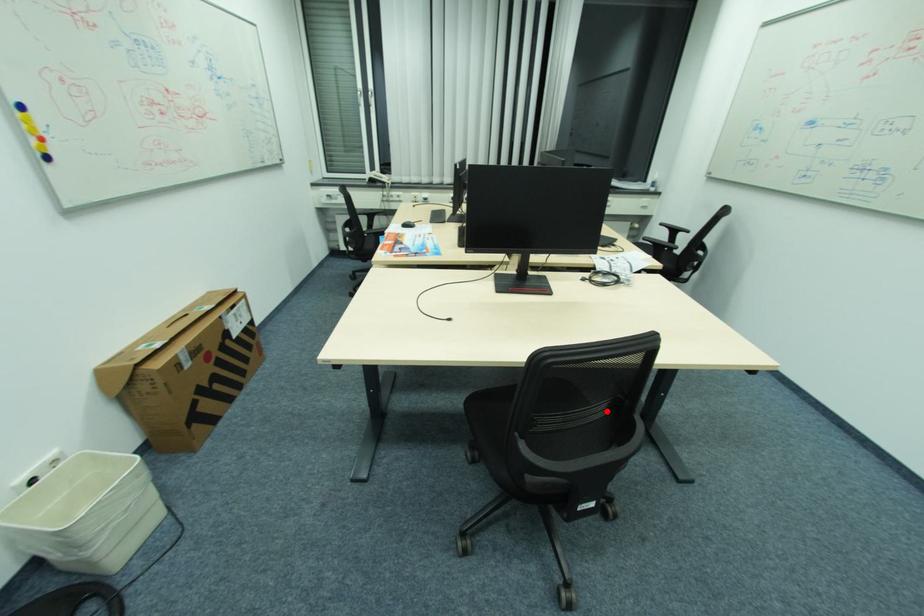
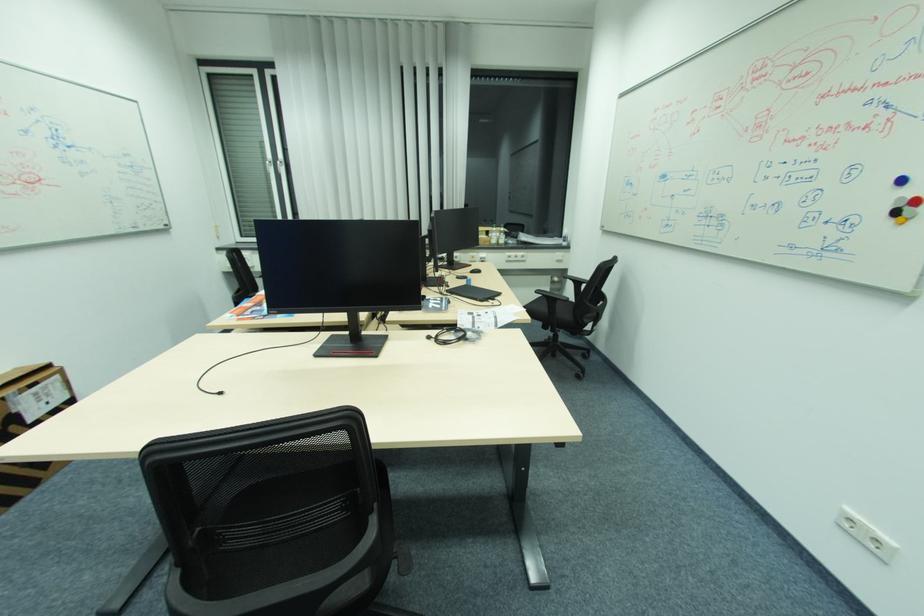
The point at the highlighted location is marked in the first image. Where is the corresponding point in the second image?

(339, 512)